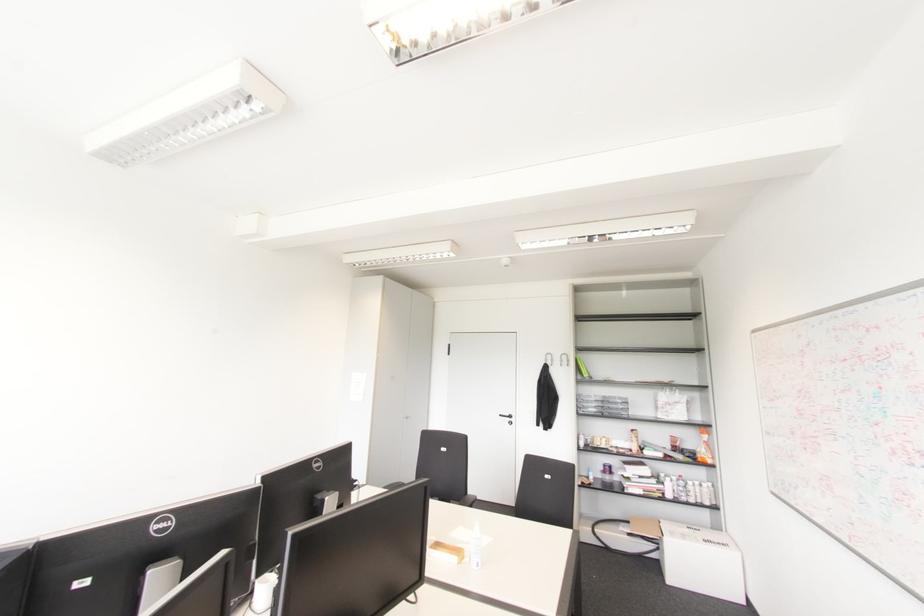
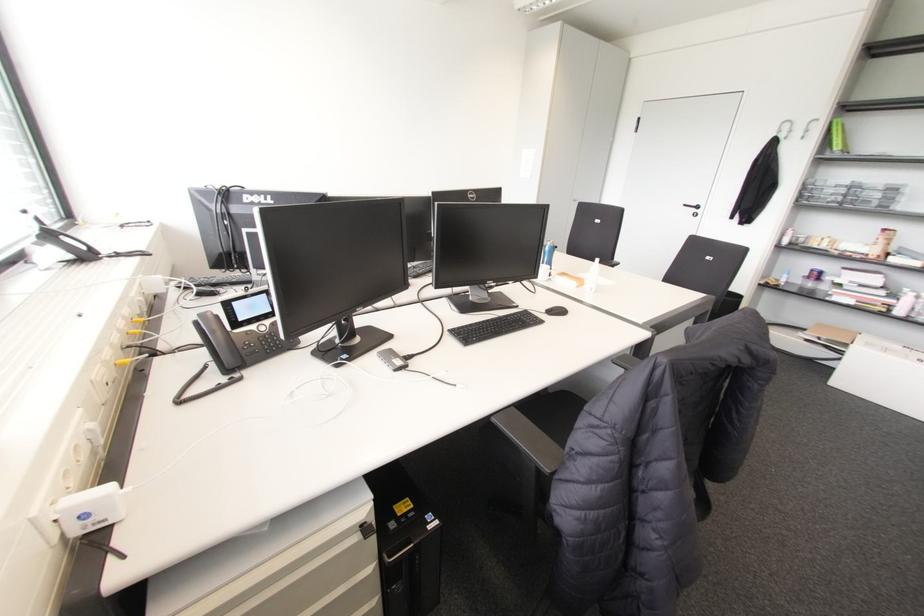
In the second image, find the point that corresponds to the point at 509,416 in the first image.

(697, 207)